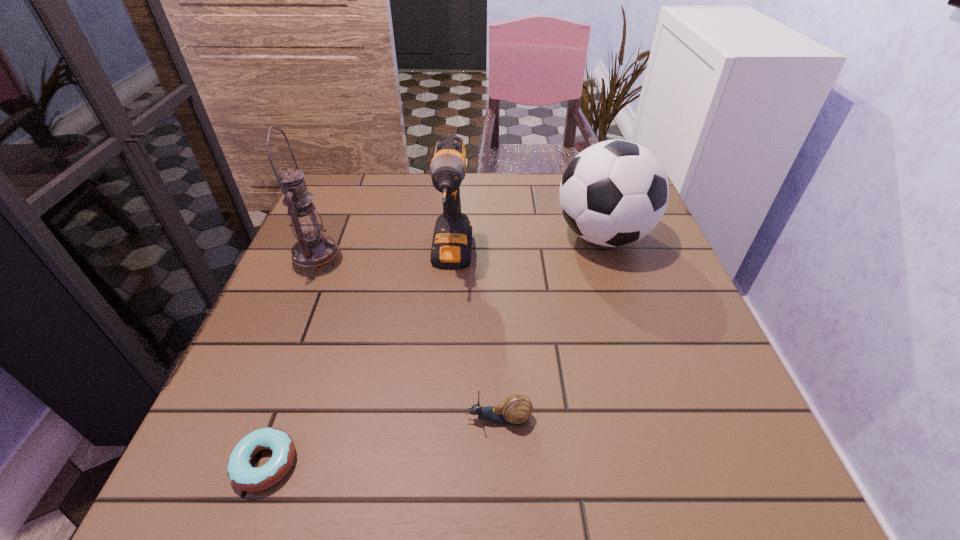
Find the location of a particular element. Image resolution: width=960 pixels, height=540 pixels. object positioned at the far right corner is located at coordinates (613, 193).

Locate an element on the screen. The height and width of the screenshot is (540, 960). vacant point at the far edge is located at coordinates (540, 184).

Locate an element on the screen. vacant area at the near edge of the desktop is located at coordinates (530, 482).

The width and height of the screenshot is (960, 540). What are the coordinates of `vacant space at the left edge of the desktop` in the screenshot? It's located at (272, 340).

Identify the location of vacant area at the right edge. Image resolution: width=960 pixels, height=540 pixels. (729, 402).

In the image, there is a desktop. Where is `vacant region at the far left corner`? This screenshot has height=540, width=960. vacant region at the far left corner is located at coordinates (380, 175).

Find the location of a particular element. This screenshot has width=960, height=540. vacant region at the near left corner of the desktop is located at coordinates (198, 462).

The image size is (960, 540). Identify the location of empty location between the nearest object and the drill. (359, 361).

You are a GUI agent. You are given a task and a screenshot of the screen. Output one action in this format:
    pyautogui.click(x=<x>, y=<y>)
    Task: Click on the free space between the soccer ball and the drill
    This screenshot has width=960, height=540.
    Given the screenshot: What is the action you would take?
    pyautogui.click(x=527, y=247)

The image size is (960, 540). I want to click on free space between the drill and the rightmost object, so click(527, 247).